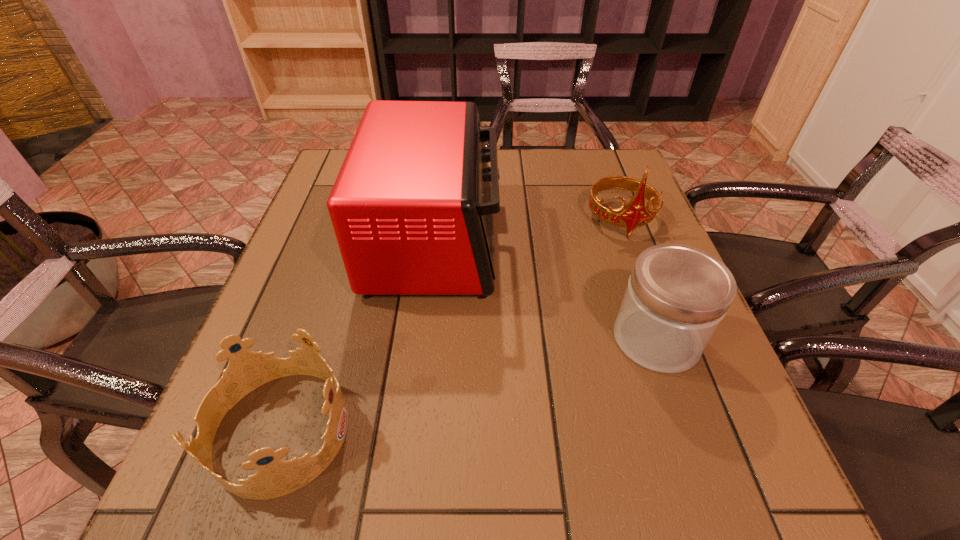
Locate an element on the screen. This screenshot has width=960, height=540. free area in between the third tallest object and the shortest object is located at coordinates (468, 384).

At what (x,y) coordinates should I click in order to perform the action: click on unoccupied position between the tallest object and the second shortest object. Please return your answer as a coordinate pair (x, y). The image size is (960, 540). Looking at the image, I should click on (546, 289).

Locate an element on the screen. The height and width of the screenshot is (540, 960). unoccupied area between the toaster oven and the right tiara is located at coordinates (528, 230).

You are a GUI agent. You are given a task and a screenshot of the screen. Output one action in this format:
    pyautogui.click(x=<x>, y=<y>)
    Task: Click on the vacant area that lies between the nearer tiara and the toaster oven
    
    Given the screenshot: What is the action you would take?
    pyautogui.click(x=358, y=335)

Locate an element on the screen. The height and width of the screenshot is (540, 960). free space that is in between the third tallest object and the toaster oven is located at coordinates (546, 289).

Find the location of a particular element. vacant space in between the shortest object and the right tiara is located at coordinates (450, 325).

Where is `unoccupied position between the shorter tiara and the toaster oven`? Image resolution: width=960 pixels, height=540 pixels. unoccupied position between the shorter tiara and the toaster oven is located at coordinates (358, 335).

Locate an element on the screen. This screenshot has height=540, width=960. free spot between the shorter tiara and the right tiara is located at coordinates (450, 325).

In order to click on empty space between the tallest object and the jar in this screenshot , I will do `click(546, 289)`.

Identify the location of object that stands as the closest to the tallest object. (247, 370).